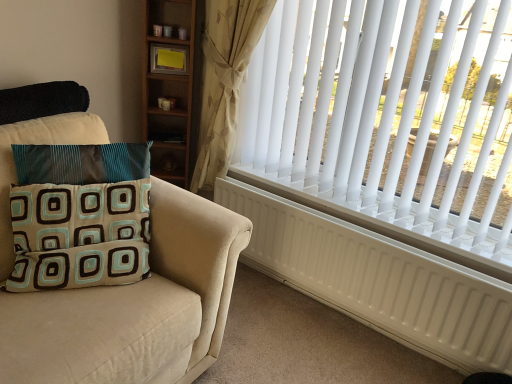
Question: From the image's perspective, is teal and brown fabric pillow at left located beneath white matte radiator at right?

Choices:
 (A) yes
 (B) no

Answer: (B)

Question: Is teal and brown fabric pillow at left not close to white matte radiator at right?

Choices:
 (A) no
 (B) yes

Answer: (A)

Question: From the image's perspective, is teal and brown fabric pillow at left over white matte radiator at right?

Choices:
 (A) yes
 (B) no

Answer: (A)

Question: From a real-world perspective, is teal and brown fabric pillow at left below white matte radiator at right?

Choices:
 (A) no
 (B) yes

Answer: (A)

Question: Can you confirm if teal and brown fabric pillow at left is smaller than white matte radiator at right?

Choices:
 (A) yes
 (B) no

Answer: (A)

Question: From a real-world perspective, is beige floral fabric curtain at upper right physically located above or below teal and brown fabric pillow at left?

Choices:
 (A) above
 (B) below

Answer: (A)

Question: From the image's perspective, is beige floral fabric curtain at upper right positioned above or below teal and brown fabric pillow at left?

Choices:
 (A) below
 (B) above

Answer: (B)

Question: Relative to teal and brown fabric pillow at left, is beige floral fabric curtain at upper right in front or behind?

Choices:
 (A) behind
 (B) front

Answer: (A)

Question: In terms of width, does beige floral fabric curtain at upper right look wider or thinner when compared to teal and brown fabric pillow at left?

Choices:
 (A) thin
 (B) wide

Answer: (A)

Question: In the image, is white matte radiator at right on the left side or the right side of beige floral fabric curtain at upper right?

Choices:
 (A) left
 (B) right

Answer: (B)

Question: Is white matte radiator at right bigger or smaller than beige floral fabric curtain at upper right?

Choices:
 (A) small
 (B) big

Answer: (A)

Question: In terms of height, does white matte radiator at right look taller or shorter compared to beige floral fabric curtain at upper right?

Choices:
 (A) short
 (B) tall

Answer: (A)

Question: Is white matte radiator at right inside or outside of beige floral fabric curtain at upper right?

Choices:
 (A) inside
 (B) outside

Answer: (B)

Question: Looking at the image, does white plastic blinds at upper right seem bigger or smaller compared to teal and brown fabric pillow at left?

Choices:
 (A) big
 (B) small

Answer: (A)

Question: In terms of width, does white plastic blinds at upper right look wider or thinner when compared to teal and brown fabric pillow at left?

Choices:
 (A) wide
 (B) thin

Answer: (B)